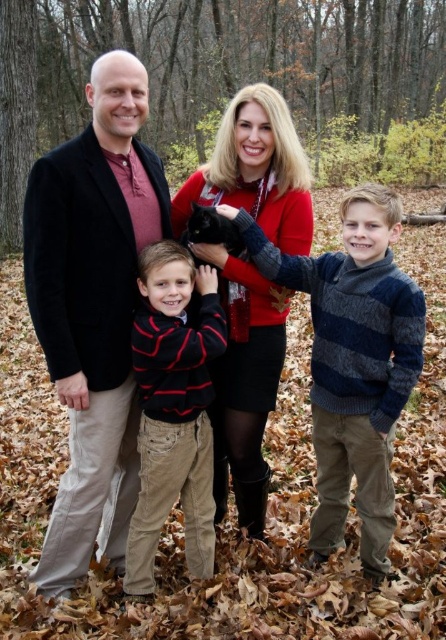
Is striped wool sweater at center thinner than striped cotton shirt at center?

In fact, striped wool sweater at center might be wider than striped cotton shirt at center.

Does striped wool sweater at center come in front of striped cotton shirt at center?

Yes.

Where is `striped wool sweater at center`? This screenshot has width=446, height=640. striped wool sweater at center is located at coordinates (354, 364).

Locate an element on the screen. Image resolution: width=446 pixels, height=640 pixels. striped wool sweater at center is located at coordinates (354, 364).

How much distance is there between black cotton jacket at left and velvet red sweater at center?

black cotton jacket at left is 1.15 meters from velvet red sweater at center.

Is black cotton jacket at left above velvet red sweater at center?

Yes.

Does point (100, 324) come farther from viewer compared to point (215, 380)?

That is False.

The width and height of the screenshot is (446, 640). Find the location of `black cotton jacket at left`. black cotton jacket at left is located at coordinates click(93, 308).

You are a GUI agent. You are given a task and a screenshot of the screen. Output one action in this format:
    pyautogui.click(x=<x>, y=<y>)
    Task: Click on the striped wool sweater at center
    
    Given the screenshot: What is the action you would take?
    pyautogui.click(x=354, y=364)

Can you confirm if striped wool sweater at center is smaller than velvet red sweater at center?

No.

This screenshot has width=446, height=640. In order to click on striped wool sweater at center in this screenshot , I will do `click(354, 364)`.

The height and width of the screenshot is (640, 446). Identify the location of striped wool sweater at center. (354, 364).